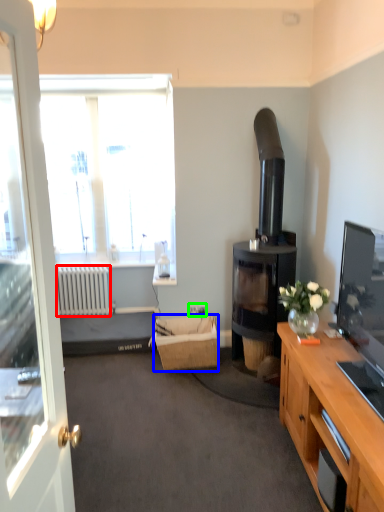
Question: Which object is the farthest from radiator (highlighted by a red box)? Choose among these: picnic basket (highlighted by a blue box) or power outlet (highlighted by a green box).

Choices:
 (A) picnic basket
 (B) power outlet

Answer: (B)